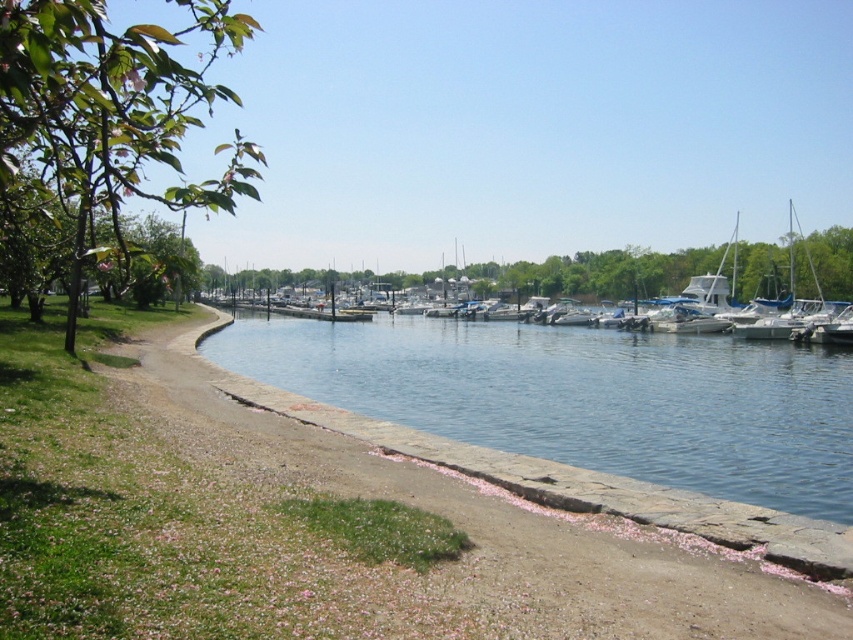
Does clear blue water at center appear under white glossy boat at center?

Indeed, clear blue water at center is positioned under white glossy boat at center.

Is point (531, 365) positioned after point (653, 289)?

No, it is in front of (653, 289).

Which is in front, point (778, 362) or point (780, 252)?

Point (778, 362) is in front.

At what (x,y) coordinates should I click in order to perform the action: click on clear blue water at center. Please return your answer as a coordinate pair (x, y). The height and width of the screenshot is (640, 853). Looking at the image, I should click on (583, 397).